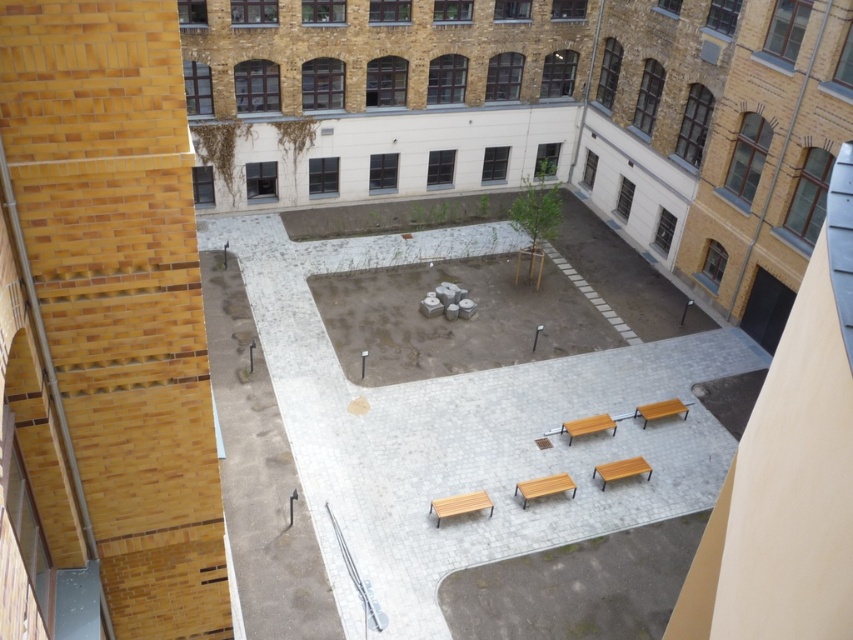
Who is more forward, (262, 342) or (682, 412)?

Point (682, 412) is in front.

Which of these two, smooth concrete bench at center or orange matte park bench at lower right, stands shorter?

With less height is orange matte park bench at lower right.

Measure the distance between point (x=430, y=573) and camera.

Point (x=430, y=573) and camera are 54.26 feet apart from each other.

This screenshot has width=853, height=640. In order to click on smooth concrete bench at center in this screenshot , I will do [x=460, y=426].

Consider the image. Which is more to the left, wooden bench at lower right or orange matte park bench at lower right?

wooden bench at lower right is more to the left.

Between wooden bench at lower right and orange matte park bench at lower right, which one has more height?

Standing taller between the two is orange matte park bench at lower right.

Identify the location of wooden bench at lower right. This screenshot has width=853, height=640. (621, 468).

Does smooth concrete bench at center come in front of brown wooden bench at center?

That is True.

Is point (650, 497) closer to viewer compared to point (563, 490)?

No, it is behind (563, 490).

Who is more forward, [563,360] or [544,496]?

Positioned in front is point [544,496].

Identify the location of smooth concrete bench at center. Image resolution: width=853 pixels, height=640 pixels. (460, 426).